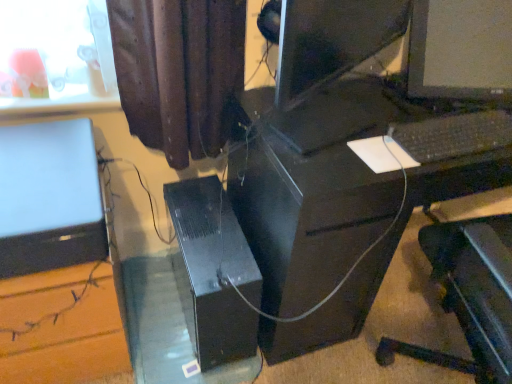
Locate an element on the screen. This screenshot has height=384, width=512. free space above satin silver laptop at left (from a real-world perspective) is located at coordinates (38, 169).